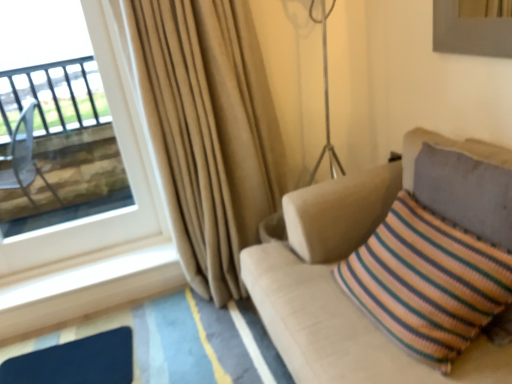
What do you see at coordinates (123, 162) in the screenshot?
I see `transparent glass window at upper left` at bounding box center [123, 162].

What do you see at coordinates (75, 362) in the screenshot?
I see `matte blue mat at lower left` at bounding box center [75, 362].

The image size is (512, 384). What are the coordinates of `beige fabric curtain at left` in the screenshot? It's located at (209, 131).

What are the coordinates of `studio couch on the right of transparent glass window at upper left` in the screenshot? It's located at (340, 287).

Can you confirm if transparent glass window at upper left is wider than beige fabric couch at right?

Incorrect, the width of transparent glass window at upper left does not surpass that of beige fabric couch at right.

From a real-world perspective, is transparent glass window at upper left physically above beige fabric couch at right?

Correct, in the physical world, transparent glass window at upper left is higher than beige fabric couch at right.

From the image's perspective, which one is positioned higher, transparent glass window at upper left or beige fabric couch at right?

transparent glass window at upper left appears higher in the image.

From a real-world perspective, is beige fabric curtain at left located higher than beige fabric couch at right?

Yes, from a real-world perspective, beige fabric curtain at left is on top of beige fabric couch at right.

Does beige fabric curtain at left have a larger size compared to beige fabric couch at right?

Actually, beige fabric curtain at left might be smaller than beige fabric couch at right.

Is beige fabric curtain at left oriented towards beige fabric couch at right?

Yes.

Is beige fabric couch at right facing away from beige fabric curtain at left?

No, beige fabric couch at right's orientation is not away from beige fabric curtain at left.

Would you say beige fabric curtain at left is part of beige fabric couch at right's contents?

No, beige fabric couch at right does not contain beige fabric curtain at left.

Is the surface of beige fabric couch at right in direct contact with beige fabric curtain at left?

They are not placed beside each other.

From the picture: How different are the orientations of matte blue mat at lower left and beige fabric couch at right in degrees?

The angle between the facing direction of matte blue mat at lower left and the facing direction of beige fabric couch at right is 85 degrees.

Considering the sizes of matte blue mat at lower left and beige fabric couch at right in the image, is matte blue mat at lower left wider or thinner than beige fabric couch at right?

Clearly, matte blue mat at lower left has less width compared to beige fabric couch at right.

Considering the sizes of objects matte blue mat at lower left and beige fabric couch at right in the image provided, who is shorter, matte blue mat at lower left or beige fabric couch at right?

With less height is matte blue mat at lower left.

Between beige fabric curtain at left and transparent glass window at upper left, which one appears on the right side from the viewer's perspective?

From the viewer's perspective, beige fabric curtain at left appears more on the right side.

From a real-world perspective, is beige fabric curtain at left located higher than transparent glass window at upper left?

No, from a real-world perspective, beige fabric curtain at left is not above transparent glass window at upper left.

Is beige fabric curtain at left in front of transparent glass window at upper left?

Yes, beige fabric curtain at left is closer to the camera.

Considering the positions of points (249, 48) and (10, 249), is point (249, 48) closer to camera compared to point (10, 249)?

Yes, it is in front of point (10, 249).

Is beige fabric curtain at left positioned with its back to matte blue mat at lower left?

beige fabric curtain at left does not have its back to matte blue mat at lower left.

From a real-world perspective, is beige fabric curtain at left located beneath matte blue mat at lower left?

No, from a real-world perspective, beige fabric curtain at left is not beneath matte blue mat at lower left.

Does beige fabric curtain at left have a smaller size compared to matte blue mat at lower left?

Actually, beige fabric curtain at left might be larger than matte blue mat at lower left.

Considering the relative positions of beige fabric curtain at left and matte blue mat at lower left in the image provided, is beige fabric curtain at left to the left of matte blue mat at lower left from the viewer's perspective?

No, beige fabric curtain at left is not to the left of matte blue mat at lower left.

Who is smaller, matte blue mat at lower left or beige fabric curtain at left?

Smaller between the two is matte blue mat at lower left.

From a real-world perspective, does matte blue mat at lower left stand above beige fabric curtain at left?

No, from a real-world perspective, matte blue mat at lower left is not over beige fabric curtain at left

Does matte blue mat at lower left turn towards beige fabric curtain at left?

No, matte blue mat at lower left does not turn towards beige fabric curtain at left.

Is beige fabric curtain at left inside matte blue mat at lower left?

That's incorrect, beige fabric curtain at left is not inside matte blue mat at lower left.

Where is `studio couch in front of the transparent glass window at upper left`? studio couch in front of the transparent glass window at upper left is located at coordinates (340, 287).

Identify the location of curtain above the beige fabric couch at right (from a real-world perspective). (209, 131).

Considering their positions, is beige fabric curtain at left positioned closer to matte blue mat at lower left than transparent glass window at upper left?

transparent glass window at upper left lies closer to matte blue mat at lower left than the other object.

Considering their positions, is beige fabric curtain at left positioned further to transparent glass window at upper left than matte blue mat at lower left?

Among the two, matte blue mat at lower left is located further to transparent glass window at upper left.

Based on their spatial positions, is beige fabric couch at right or transparent glass window at upper left closer to matte blue mat at lower left?

transparent glass window at upper left is positioned closer to the anchor matte blue mat at lower left.

From the image, which object appears to be farther from matte blue mat at lower left, transparent glass window at upper left or beige fabric couch at right?

beige fabric couch at right is positioned further to the anchor matte blue mat at lower left.

Considering their positions, is transparent glass window at upper left positioned closer to beige fabric curtain at left than matte blue mat at lower left?

transparent glass window at upper left lies closer to beige fabric curtain at left than the other object.

From the image, which object appears to be nearer to matte blue mat at lower left, transparent glass window at upper left or beige fabric curtain at left?

transparent glass window at upper left.

Which object lies further to the anchor point beige fabric couch at right, matte blue mat at lower left or transparent glass window at upper left?

The object further to beige fabric couch at right is transparent glass window at upper left.

Looking at the image, which one is located closer to beige fabric curtain at left, beige fabric couch at right or matte blue mat at lower left?

beige fabric couch at right is closer to beige fabric curtain at left.

Find the location of a particular element. The width and height of the screenshot is (512, 384). flat between transparent glass window at upper left and beige fabric couch at right is located at coordinates (75, 362).

You are a GUI agent. You are given a task and a screenshot of the screen. Output one action in this format:
    pyautogui.click(x=<x>, y=<y>)
    Task: Click on the curtain between matte blue mat at lower left and beige fabric couch at right
    The width and height of the screenshot is (512, 384).
    Given the screenshot: What is the action you would take?
    pyautogui.click(x=209, y=131)

You are a GUI agent. You are given a task and a screenshot of the screen. Output one action in this format:
    pyautogui.click(x=<x>, y=<y>)
    Task: Click on the curtain between transparent glass window at upper left and matte blue mat at lower left vertically
    The height and width of the screenshot is (384, 512).
    Given the screenshot: What is the action you would take?
    pyautogui.click(x=209, y=131)

Image resolution: width=512 pixels, height=384 pixels. Find the location of `curtain between transparent glass window at upper left and beige fabric couch at right in the horizontal direction`. curtain between transparent glass window at upper left and beige fabric couch at right in the horizontal direction is located at coordinates (209, 131).